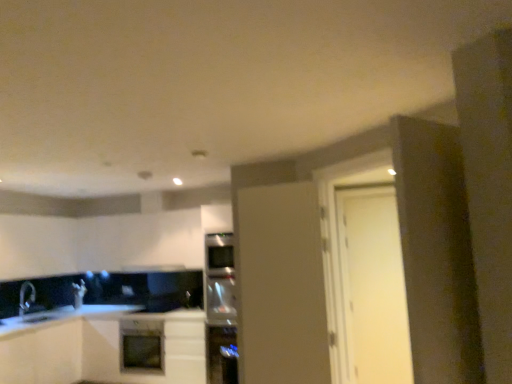
Question: Is white matte cabinet at center, positioned as the 1th cabinetry in right-to-left order, taller than black matte exhaust hood at center?

Choices:
 (A) no
 (B) yes

Answer: (B)

Question: Is white matte cabinet at center, positioned as the 1th cabinetry in right-to-left order, aimed at black matte exhaust hood at center?

Choices:
 (A) yes
 (B) no

Answer: (B)

Question: Is white matte cabinet at center, positioned as the 1th cabinetry in right-to-left order, turned away from black matte exhaust hood at center?

Choices:
 (A) yes
 (B) no

Answer: (B)

Question: Considering the relative sizes of white matte cabinet at center, marked as the second cabinetry in a left-to-right arrangement, and black matte exhaust hood at center in the image provided, is white matte cabinet at center, marked as the second cabinetry in a left-to-right arrangement, bigger than black matte exhaust hood at center?

Choices:
 (A) yes
 (B) no

Answer: (A)

Question: Is white matte cabinet at center, marked as the second cabinetry in a left-to-right arrangement, outside of black matte exhaust hood at center?

Choices:
 (A) no
 (B) yes

Answer: (B)

Question: Considering the positions of matte white door at center, the second door from the right, and black matte exhaust hood at center in the image, is matte white door at center, the second door from the right, taller or shorter than black matte exhaust hood at center?

Choices:
 (A) short
 (B) tall

Answer: (B)

Question: Which is correct: matte white door at center, acting as the first door starting from the left, is inside black matte exhaust hood at center, or outside of it?

Choices:
 (A) outside
 (B) inside

Answer: (A)

Question: From the image's perspective, is matte white door at center, acting as the first door starting from the left, located above or below black matte exhaust hood at center?

Choices:
 (A) below
 (B) above

Answer: (B)

Question: Looking at the image, does matte white door at center, positioned as the 1th door in front-to-back order, seem bigger or smaller compared to black matte exhaust hood at center?

Choices:
 (A) small
 (B) big

Answer: (B)

Question: In the image, is matte white door at center, positioned as the 1th door in front-to-back order, on the left side or the right side of sleek stainless steel refrigerator at center, the second appliance positioned from the bottom?

Choices:
 (A) left
 (B) right

Answer: (B)

Question: Considering their positions, is matte white door at center, the second door from the right, located in front of or behind sleek stainless steel refrigerator at center, marked as the 1th appliance in a top-to-bottom arrangement?

Choices:
 (A) behind
 (B) front

Answer: (B)

Question: From a real-world perspective, is matte white door at center, which is counted as the 2th door, starting from the back, positioned above or below sleek stainless steel refrigerator at center, the second appliance positioned from the bottom?

Choices:
 (A) below
 (B) above

Answer: (B)

Question: Choose the correct answer: Is matte white door at center, acting as the first door starting from the left, inside sleek stainless steel refrigerator at center, the second appliance positioned from the bottom, or outside it?

Choices:
 (A) inside
 (B) outside

Answer: (B)

Question: Is white matte door at right, the first door in the right-to-left sequence, situated inside white matte cabinet at center, marked as the second cabinetry in a left-to-right arrangement, or outside?

Choices:
 (A) inside
 (B) outside

Answer: (B)

Question: Does point (374, 271) appear closer or farther from the camera than point (103, 329)?

Choices:
 (A) closer
 (B) farther

Answer: (B)